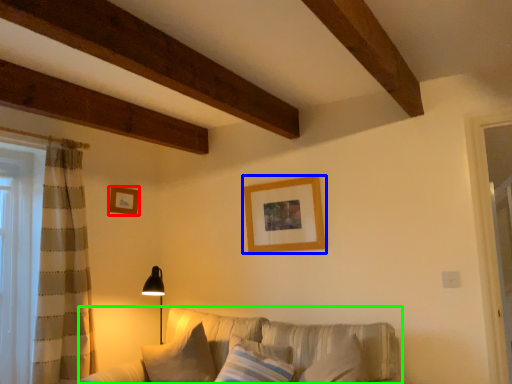
Question: Considering the real-world distances, which object is farthest from picture frame (highlighted by a red box)? picture frame (highlighted by a blue box) or studio couch (highlighted by a green box)?

Choices:
 (A) picture frame
 (B) studio couch

Answer: (B)